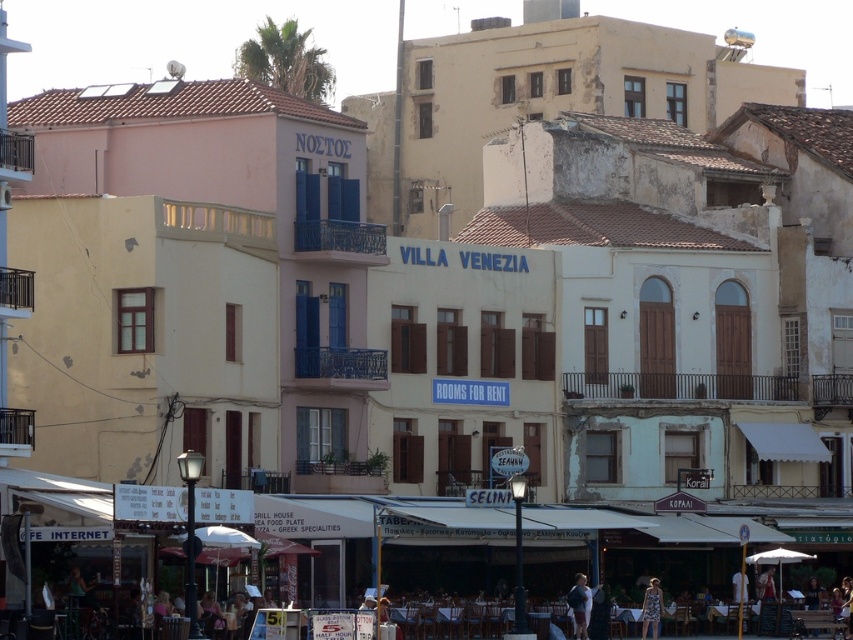
Who is positioned more to the left, light blue fabric dress at lower center or printed fabric dress at lower right?

Positioned to the left is light blue fabric dress at lower center.

Is light blue fabric dress at lower center closer to the viewer compared to printed fabric dress at lower right?

No, it is not.

Which is in front, point (575, 612) or point (656, 586)?

Point (575, 612) is more forward.

Where is `light blue fabric dress at lower center`? This screenshot has height=640, width=853. light blue fabric dress at lower center is located at coordinates 579,604.